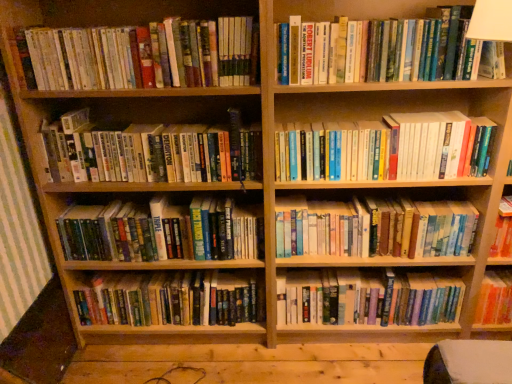
Question: Based on their sizes in the image, would you say hardcover books at center, positioned as the 6th book in top-to-bottom order, is bigger or smaller than hardcover books at center, positioned as the fourth book in top-to-bottom order?

Choices:
 (A) small
 (B) big

Answer: (B)

Question: Is hardcover books at center, arranged as the 3th book when ordered from the bottom, situated inside hardcover books at center, which appears as the fifth book when ordered from the bottom, or outside?

Choices:
 (A) outside
 (B) inside

Answer: (A)

Question: Which object is positioned farthest from the hardcover books at upper right?

Choices:
 (A) hardcover book at upper right, the 8th book when ordered from bottom to top
 (B) hardcover books at center, positioned as the fourth book in top-to-bottom order
 (C) hardcover book at center, positioned as the fifth book in top-to-bottom order
 (D) hardcover books at upper left, the second book from the top
 (E) hardcover books at center, arranged as the 3th book when ordered from the bottom

Answer: (C)

Question: Which object is the closest to the hardcover books at left, positioned as the sixth book in bottom-to-top order?

Choices:
 (A) hardcover books at upper right
 (B) hardcover book at upper right, the 8th book when ordered from bottom to top
 (C) hardcover books at center, positioned as the fourth book in top-to-bottom order
 (D) hardcover books at center, positioned as the eighth book in top-to-bottom order
 (E) hardcover books at center, arranged as the 3th book when ordered from the bottom

Answer: (C)